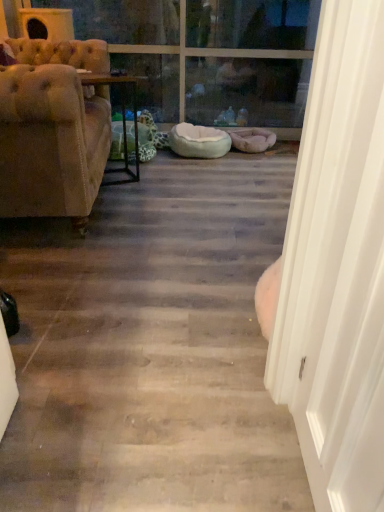
Question: Is transparent glass door at upper center inside or outside of white smooth door at right?

Choices:
 (A) inside
 (B) outside

Answer: (B)

Question: Is transparent glass door at upper center wider or thinner than white smooth door at right?

Choices:
 (A) thin
 (B) wide

Answer: (B)

Question: Which of these objects is positioned closest to the wooden table at center?

Choices:
 (A) white smooth door at right
 (B) transparent glass door at upper center
 (C) light blue plush dog bed at center
 (D) tufted beige fabric couch at left
 (E) clear glass window at upper center

Answer: (C)

Question: Considering the real-world distances, which object is closest to the wooden table at center?

Choices:
 (A) clear glass window at upper center
 (B) transparent glass door at upper center
 (C) tufted beige fabric couch at left
 (D) light blue plush dog bed at center
 (E) white smooth door at right

Answer: (D)